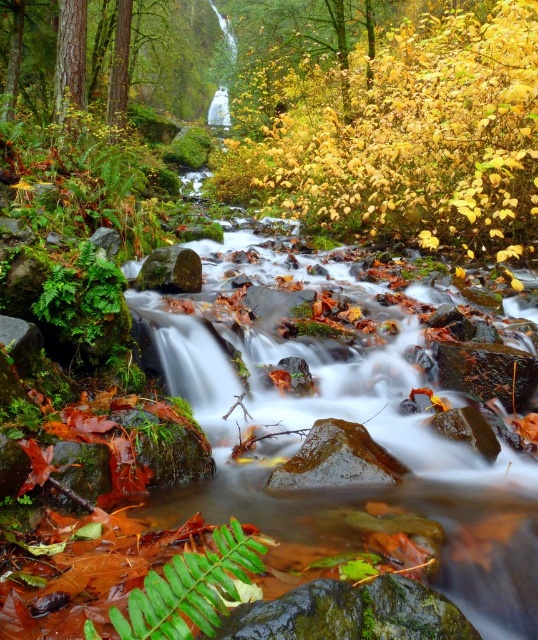
You are a hiker who wants to cross the stream using the green mossy rock at center. Before stepping onto it, you need to compare its width with the smooth bark tree at upper left to ensure it can support your weight. Which object is wider?

The smooth bark tree at upper left might be wider than green mossy rock at center, so it is possible that the tree is wider. However, since the question is about the rock supporting weight, the actual width needed for support depends on the rock itself. The description only suggests the tree might be wider, but without exact measurements, we can only state the comparison as given.

From the picture: You are standing at the center of the stream and want to locate the green matte fern at lower left. Which direction should you face to see it?

You should face the lower left direction to see the green matte fern at lower left, as it is located at point (190, 588).

From the picture: You are standing at the point closer to the camera in the image. Which point are you at, point (53, 61) or point (157, 634)?

You are at point (53, 61) because it is further to the camera than point (157, 634).